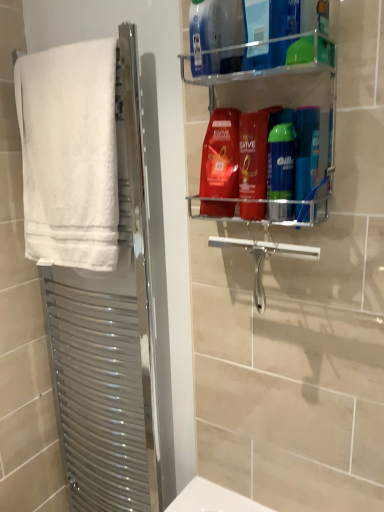
Question: From the image's perspective, does blue glossy shampoo at upper right, which is counted as the 1th toiletry, starting from the right, appear higher than green glossy shaving cream can at center right, the second toiletry positioned from the right?

Choices:
 (A) yes
 (B) no

Answer: (B)

Question: Is blue glossy shampoo at upper right, which is counted as the 1th toiletry, starting from the right, touching green glossy shaving cream can at center right, which ranks as the 1th toiletry in left-to-right order?

Choices:
 (A) yes
 (B) no

Answer: (A)

Question: From a real-world perspective, is blue glossy shampoo at upper right, marked as the 2th toiletry in a left-to-right arrangement, below green glossy shaving cream can at center right, which ranks as the 1th toiletry in left-to-right order?

Choices:
 (A) no
 (B) yes

Answer: (B)

Question: Can we say blue glossy shampoo at upper right, marked as the 2th toiletry in a left-to-right arrangement, lies outside green glossy shaving cream can at center right, which ranks as the 1th toiletry in left-to-right order?

Choices:
 (A) yes
 (B) no

Answer: (A)

Question: Considering the relative positions of blue glossy shampoo at upper right, which is counted as the 1th toiletry, starting from the right, and green glossy shaving cream can at center right, the second toiletry positioned from the right, in the image provided, is blue glossy shampoo at upper right, which is counted as the 1th toiletry, starting from the right, to the right of green glossy shaving cream can at center right, the second toiletry positioned from the right, from the viewer's perspective?

Choices:
 (A) no
 (B) yes

Answer: (B)

Question: Is shiny red shampoo at center, the second cleaning product when ordered from bottom to top, wider or thinner than clear plastic shelf at upper right?

Choices:
 (A) thin
 (B) wide

Answer: (A)

Question: From the image's perspective, relative to clear plastic shelf at upper right, is shiny red shampoo at center, the second cleaning product when ordered from top to bottom, above or below?

Choices:
 (A) above
 (B) below

Answer: (B)

Question: Relative to clear plastic shelf at upper right, is shiny red shampoo at center, the second cleaning product when ordered from top to bottom, in front or behind?

Choices:
 (A) behind
 (B) front

Answer: (A)

Question: In terms of height, does shiny red shampoo at center, the second cleaning product when ordered from bottom to top, look taller or shorter compared to clear plastic shelf at upper right?

Choices:
 (A) tall
 (B) short

Answer: (B)

Question: From a real-world perspective, is blue glossy shampoo at upper right, marked as the 2th toiletry in a left-to-right arrangement, positioned above or below clear plastic shelf at upper right?

Choices:
 (A) below
 (B) above

Answer: (A)

Question: Is blue glossy shampoo at upper right, marked as the 2th toiletry in a left-to-right arrangement, wider or thinner than clear plastic shelf at upper right?

Choices:
 (A) thin
 (B) wide

Answer: (A)

Question: In terms of height, does blue glossy shampoo at upper right, which is counted as the 1th toiletry, starting from the right, look taller or shorter compared to clear plastic shelf at upper right?

Choices:
 (A) short
 (B) tall

Answer: (A)

Question: Considering their positions, is blue glossy shampoo at upper right, marked as the 2th toiletry in a left-to-right arrangement, located in front of or behind clear plastic shelf at upper right?

Choices:
 (A) front
 (B) behind

Answer: (B)

Question: Is white fluffy towel at left wider or thinner than silver metallic towel rack at left?

Choices:
 (A) thin
 (B) wide

Answer: (A)

Question: From a real-world perspective, is white fluffy towel at left physically located above or below silver metallic towel rack at left?

Choices:
 (A) below
 (B) above

Answer: (B)